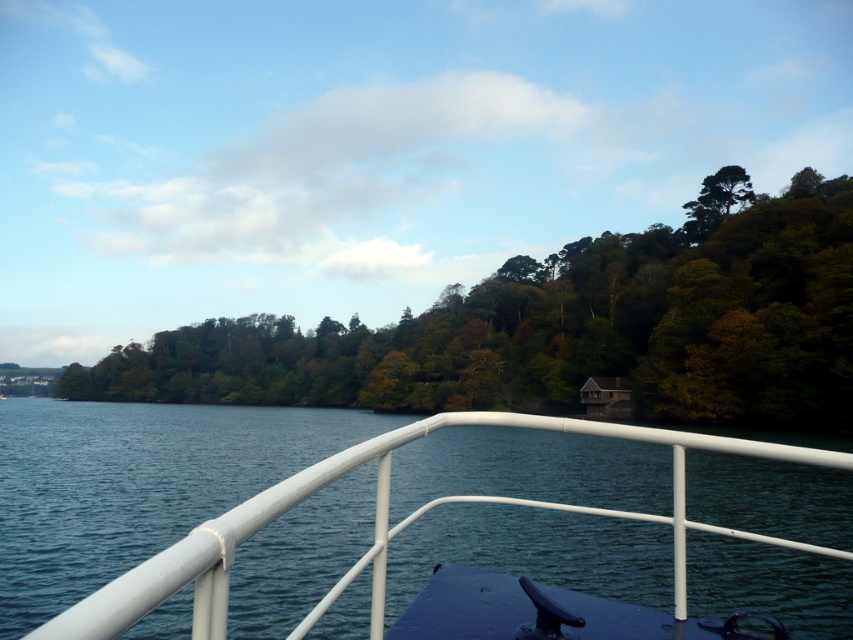
You are standing on the white metal boat at center and want to look at the green leafy trees at center. In which direction should you look to see them?

The green leafy trees at center are above the white metal boat at center, so you should look upward to see them.

From the picture: You are standing on the white metal boat at center and want to look towards the green leafy trees at center. In which direction should you turn your head?

You should turn your head to the left because the white metal boat at center is to the right of the green leafy trees at center, so facing towards them would require turning left.